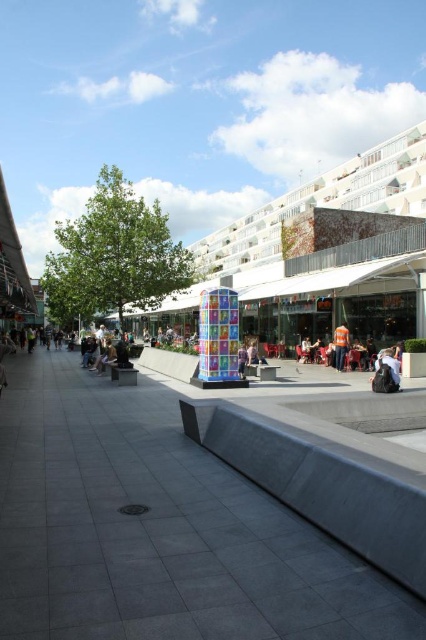
Who is more distant from viewer, (x=391, y=140) or (x=339, y=336)?

The point (x=391, y=140) is more distant.

Which is in front, point (302, 225) or point (334, 365)?

Point (334, 365)

Locate an element on the screen. multicolored glass sculpture at center is located at coordinates (322, 250).

Between gray concrete pavement at center and light brown leather jacket at center, which one is positioned lower?

gray concrete pavement at center is below.

Does gray concrete pavement at center lie behind light brown leather jacket at center?

No.

Image resolution: width=426 pixels, height=640 pixels. What do you see at coordinates (149, 532) in the screenshot?
I see `gray concrete pavement at center` at bounding box center [149, 532].

You are a GUI agent. You are given a task and a screenshot of the screen. Output one action in this format:
    pyautogui.click(x=<x>, y=<y>)
    Task: Click on the gray concrete pavement at center
    
    Given the screenshot: What is the action you would take?
    pyautogui.click(x=149, y=532)

Who is lower down, gray concrete pavement at center or multicolored glass sculpture at center?

gray concrete pavement at center

Can you confirm if gray concrete pavement at center is positioned below multicolored glass sculpture at center?

Correct, gray concrete pavement at center is located below multicolored glass sculpture at center.

Who is more forward, (226, 502) or (345, 173)?

Point (226, 502) is in front.

This screenshot has width=426, height=640. I want to click on gray concrete pavement at center, so (x=149, y=532).